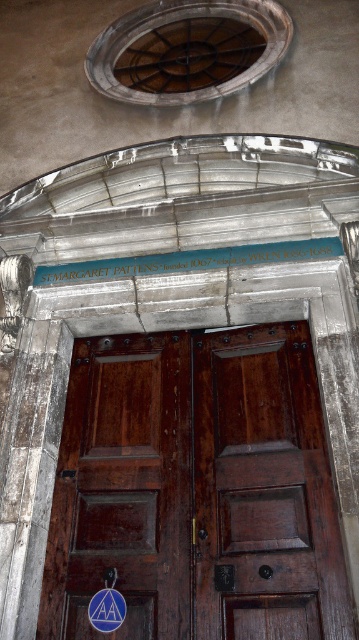
Question: Can you confirm if dark brown wood door at center is positioned to the left of black stone inscription at center?

Choices:
 (A) yes
 (B) no

Answer: (B)

Question: Can you confirm if dark brown wood door at center is smaller than black stone inscription at center?

Choices:
 (A) yes
 (B) no

Answer: (B)

Question: Among these points, which one is nearest to the camera?

Choices:
 (A) (103, 262)
 (B) (124, 352)

Answer: (B)

Question: From the image, what is the correct spatial relationship of dark brown wood door at center in relation to black stone inscription at center?

Choices:
 (A) left
 (B) right

Answer: (B)

Question: Which point is farther from the camera taking this photo?

Choices:
 (A) (72, 269)
 (B) (132, 532)

Answer: (A)